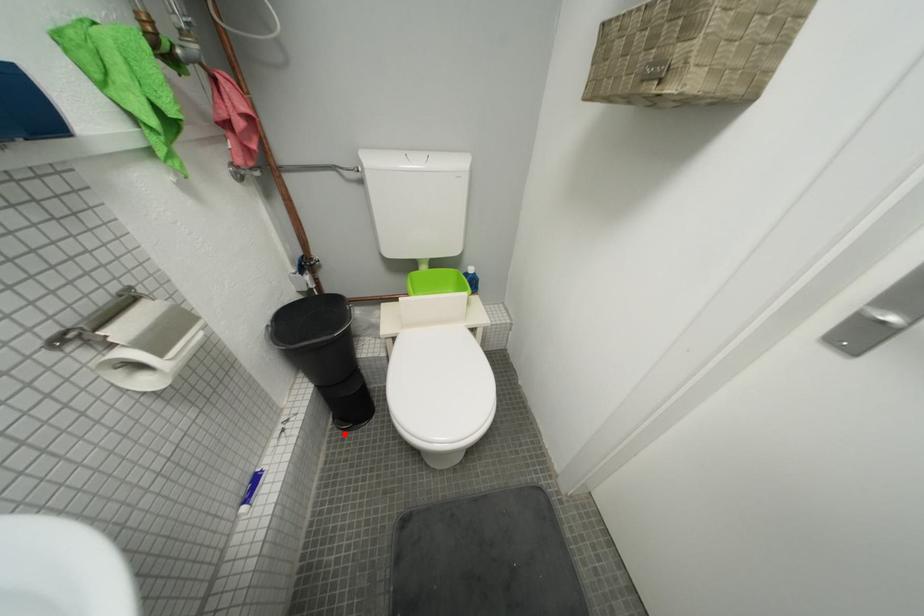
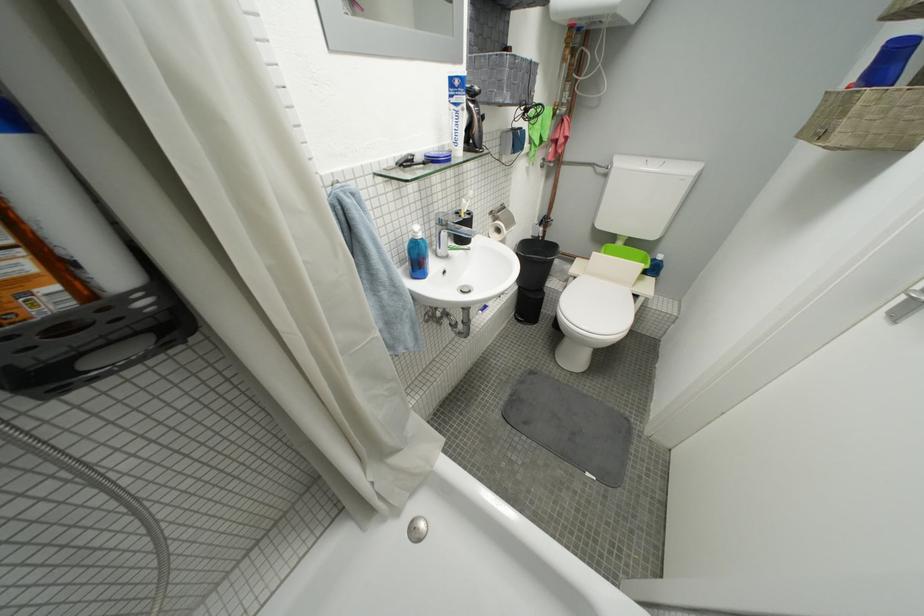
Question: I am providing you with two images of the same scene from different viewpoints. In image1, a red point is highlighted. Considering the same 3D point in image2, which of the following is correct?

Choices:
 (A) It is closer
 (B) It is farther

Answer: (A)